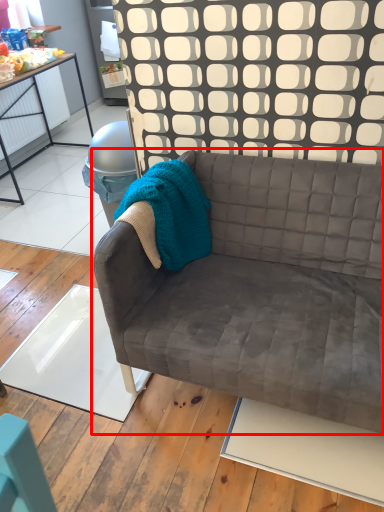
Question: Considering the relative positions of studio couch (annotated by the red box) and blanket in the image provided, where is studio couch (annotated by the red box) located with respect to the staircase?

Choices:
 (A) left
 (B) right

Answer: (B)